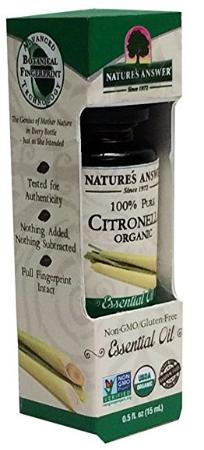
Where is `cardboard box packaging`? cardboard box packaging is located at coordinates (168, 49).